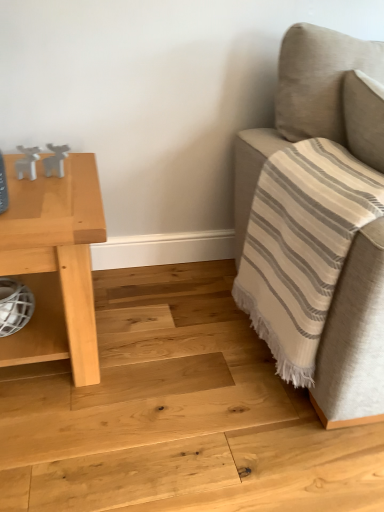
Question: Does white matte deer at left, the second toy in the right-to-left sequence, have a smaller size compared to white matte deer at upper left, which appears as the 1th toy when viewed from the right?

Choices:
 (A) yes
 (B) no

Answer: (B)

Question: Can you confirm if white matte deer at left, the second toy in the right-to-left sequence, is taller than white matte deer at upper left, which appears as the 1th toy when viewed from the right?

Choices:
 (A) yes
 (B) no

Answer: (B)

Question: Could white matte deer at upper left, the second toy positioned from the left, be considered to be inside white matte deer at left, the second toy in the right-to-left sequence?

Choices:
 (A) yes
 (B) no

Answer: (B)

Question: From the image's perspective, is white matte deer at left, positioned as the first toy in left-to-right order, on top of white matte deer at upper left, which appears as the 1th toy when viewed from the right?

Choices:
 (A) yes
 (B) no

Answer: (B)

Question: Is white matte deer at left, positioned as the first toy in left-to-right order, looking in the opposite direction of white matte deer at upper left, which appears as the 1th toy when viewed from the right?

Choices:
 (A) no
 (B) yes

Answer: (A)

Question: In the image, is white matte deer at left, the second toy in the right-to-left sequence, on the left side or the right side of beige fabric couch at right?

Choices:
 (A) right
 (B) left

Answer: (B)

Question: Is white matte deer at left, the second toy in the right-to-left sequence, inside or outside of beige fabric couch at right?

Choices:
 (A) outside
 (B) inside

Answer: (A)

Question: Does point (34, 156) appear closer or farther from the camera than point (251, 180)?

Choices:
 (A) closer
 (B) farther

Answer: (A)

Question: From a real-world perspective, relative to beige fabric couch at right, is white matte deer at left, the second toy in the right-to-left sequence, vertically above or below?

Choices:
 (A) above
 (B) below

Answer: (A)

Question: Considering the positions of light wood table at left and beige fabric couch at right in the image, is light wood table at left bigger or smaller than beige fabric couch at right?

Choices:
 (A) small
 (B) big

Answer: (A)

Question: Visually, is light wood table at left positioned to the left or to the right of beige fabric couch at right?

Choices:
 (A) left
 (B) right

Answer: (A)

Question: Choose the correct answer: Is light wood table at left inside beige fabric couch at right or outside it?

Choices:
 (A) inside
 (B) outside

Answer: (B)

Question: Is light wood table at left in front of or behind beige fabric couch at right in the image?

Choices:
 (A) behind
 (B) front

Answer: (A)

Question: From the image's perspective, is beige fabric couch at right positioned above or below light wood table at left?

Choices:
 (A) below
 (B) above

Answer: (B)

Question: Is beige fabric couch at right situated inside light wood table at left or outside?

Choices:
 (A) inside
 (B) outside

Answer: (B)